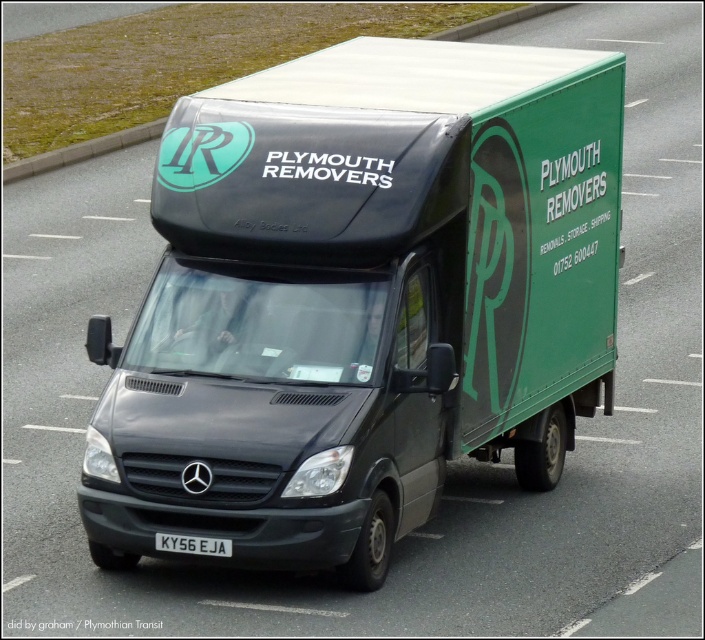
Question: Can you confirm if matte black van at center is bigger than white plastic license plate at center?

Choices:
 (A) yes
 (B) no

Answer: (A)

Question: Does matte black van at center have a greater width compared to white plastic license plate at center?

Choices:
 (A) no
 (B) yes

Answer: (B)

Question: Is matte black van at center positioned in front of white plastic license plate at center?

Choices:
 (A) yes
 (B) no

Answer: (A)

Question: Which of the following is the farthest from the observer?

Choices:
 (A) matte black van at center
 (B) white plastic license plate at center

Answer: (B)